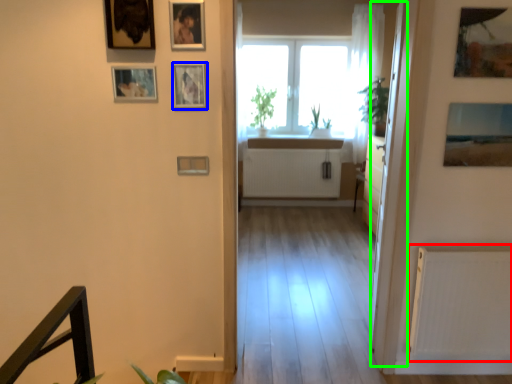
Question: Considering the real-world distances, which object is closest to radiator (highlighted by a red box)? picture frame (highlighted by a blue box) or glass door (highlighted by a green box).

Choices:
 (A) picture frame
 (B) glass door

Answer: (B)